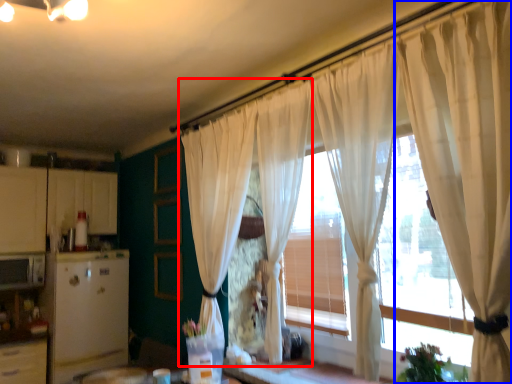
Question: Among these objects, which one is nearest to the camera, curtain (highlighted by a red box) or curtain (highlighted by a blue box)?

Choices:
 (A) curtain
 (B) curtain

Answer: (B)